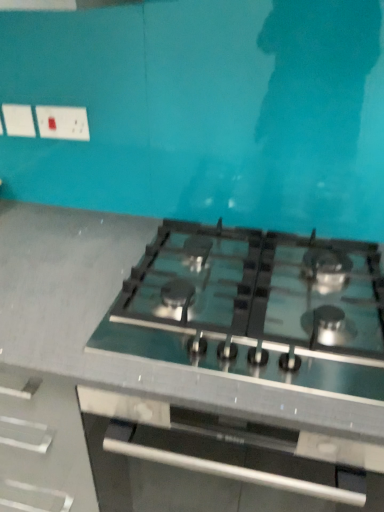
Where is `satin black gas stove at center`? The height and width of the screenshot is (512, 384). satin black gas stove at center is located at coordinates (255, 308).

Image resolution: width=384 pixels, height=512 pixels. Identify the location of white plastic socket at upper left. (63, 122).

Where is `green glass stove at center`? The height and width of the screenshot is (512, 384). green glass stove at center is located at coordinates (159, 380).

Would you say green glass stove at center is a long distance from satin black gas stove at center?

green glass stove at center is near satin black gas stove at center, not far away.

Where is `gas stove above the green glass stove at center (from the image's perspective)`? gas stove above the green glass stove at center (from the image's perspective) is located at coordinates (255, 308).

Between green glass stove at center and satin black gas stove at center, which one has larger width?

Wider between the two is green glass stove at center.

Is green glass stove at center oriented away from satin black gas stove at center?

green glass stove at center does not have its back to satin black gas stove at center.

Is white plastic socket at upper left at the back of green glass stove at center?

No, green glass stove at center's orientation is not away from white plastic socket at upper left.

At what (x,y) coordinates should I click in order to perform the action: click on countertop beneath the white plastic socket at upper left (from a real-world perspective). Please return your answer as a coordinate pair (x, y). Looking at the image, I should click on (159, 380).

Does green glass stove at center come in front of white plastic socket at upper left?

Yes, green glass stove at center is closer to the camera.

Is point (373, 448) positioned in front of point (74, 118)?

Yes.

This screenshot has width=384, height=512. What are the coordinates of `electric outlet above the satin black gas stove at center (from the image's perspective)` in the screenshot? It's located at (63, 122).

Can you confirm if white plastic socket at upper left is bigger than satin black gas stove at center?

No, white plastic socket at upper left is not bigger than satin black gas stove at center.

Does white plastic socket at upper left have a greater height compared to satin black gas stove at center?

Indeed, white plastic socket at upper left has a greater height compared to satin black gas stove at center.

Who is shorter, satin black gas stove at center or green glass stove at center?

With less height is satin black gas stove at center.

Does satin black gas stove at center have a smaller size compared to green glass stove at center?

Correct, satin black gas stove at center occupies less space than green glass stove at center.

Where is `countertop on the left of the satin black gas stove at center`? This screenshot has height=512, width=384. countertop on the left of the satin black gas stove at center is located at coordinates [x=159, y=380].

From a real-world perspective, is satin black gas stove at center positioned above or below green glass stove at center?

Clearly, from a real-world perspective, satin black gas stove at center is above green glass stove at center.

Measure the distance from white plastic socket at upper left to green glass stove at center.

The distance of white plastic socket at upper left from green glass stove at center is 25.01 inches.

Is green glass stove at center located within white plastic socket at upper left?

That's incorrect, green glass stove at center is not inside white plastic socket at upper left.

Where is `countertop in front of the white plastic socket at upper left`? Image resolution: width=384 pixels, height=512 pixels. countertop in front of the white plastic socket at upper left is located at coordinates (159, 380).

Based on the photo, from a real-world perspective, is white plastic socket at upper left physically below green glass stove at center?

Incorrect, from a real-world perspective, white plastic socket at upper left is higher than green glass stove at center.

Relative to white plastic socket at upper left, is satin black gas stove at center in front or behind?

Clearly, satin black gas stove at center is in front of white plastic socket at upper left.

Considering the relative positions of satin black gas stove at center and white plastic socket at upper left in the image provided, is satin black gas stove at center to the left of white plastic socket at upper left from the viewer's perspective?

Incorrect, satin black gas stove at center is not on the left side of white plastic socket at upper left.

Between point (331, 313) and point (85, 118), which one is positioned in front?

Positioned in front is point (331, 313).

Identify the location of gas stove below the white plastic socket at upper left (from a real-world perspective). The height and width of the screenshot is (512, 384). (255, 308).

The height and width of the screenshot is (512, 384). I want to click on countertop located on the left of satin black gas stove at center, so click(x=159, y=380).

In the image, there is a white plastic socket at upper left. At what (x,y) coordinates should I click in order to perform the action: click on countertop below it (from the image's perspective). Please return your answer as a coordinate pair (x, y). This screenshot has width=384, height=512. Looking at the image, I should click on (159, 380).

Looking at the image, which one is located closer to white plastic socket at upper left, satin black gas stove at center or green glass stove at center?

satin black gas stove at center is closer to white plastic socket at upper left.

Considering their positions, is white plastic socket at upper left positioned further to green glass stove at center than satin black gas stove at center?

Based on the image, white plastic socket at upper left appears to be further to green glass stove at center.

Looking at the image, which one is located closer to satin black gas stove at center, white plastic socket at upper left or green glass stove at center?

green glass stove at center is closer to satin black gas stove at center.

Considering their positions, is satin black gas stove at center positioned further to green glass stove at center than white plastic socket at upper left?

white plastic socket at upper left lies further to green glass stove at center than the other object.

Estimate the real-world distances between objects in this image. Which object is closer to satin black gas stove at center, green glass stove at center or white plastic socket at upper left?

Among the two, green glass stove at center is located nearer to satin black gas stove at center.

Which object lies nearer to the anchor point white plastic socket at upper left, green glass stove at center or satin black gas stove at center?

satin black gas stove at center.

Find the location of a particular element. The image size is (384, 512). gas stove between white plastic socket at upper left and green glass stove at center in the up-down direction is located at coordinates coord(255,308).